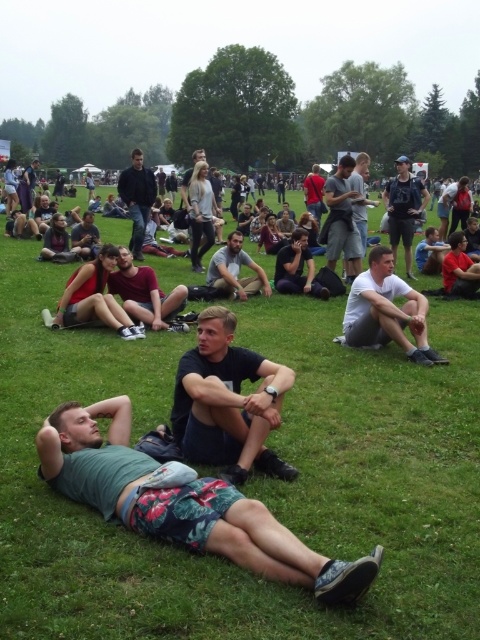
Question: Considering the real-world distances, which object is closest to the green grassy field at center?

Choices:
 (A) dark blue sweater at center
 (B) white cotton shirt at center
 (C) light gray shorts at center
 (D) dark gray t-shirt at center

Answer: (B)

Question: Can you confirm if dark blue shirt at center is positioned to the left of light gray shorts at center?

Choices:
 (A) no
 (B) yes

Answer: (A)

Question: Estimate the real-world distances between objects in this image. Which object is closer to the green fabric shorts at lower center?

Choices:
 (A) dark gray t-shirt at center
 (B) dark blue sweater at center
 (C) black matte shirt at center
 (D) green grassy field at center

Answer: (C)

Question: Where is dark gray casual pants at center located in relation to dark blue sweater at center in the image?

Choices:
 (A) below
 (B) above

Answer: (A)

Question: Does green fabric shorts at lower center have a greater width compared to light gray shorts at center?

Choices:
 (A) no
 (B) yes

Answer: (B)

Question: Which of the following is the farthest from the observer?

Choices:
 (A) dark gray casual pants at center
 (B) green grassy field at center
 (C) light gray shorts at center
 (D) light brown fabric pants at center

Answer: (C)